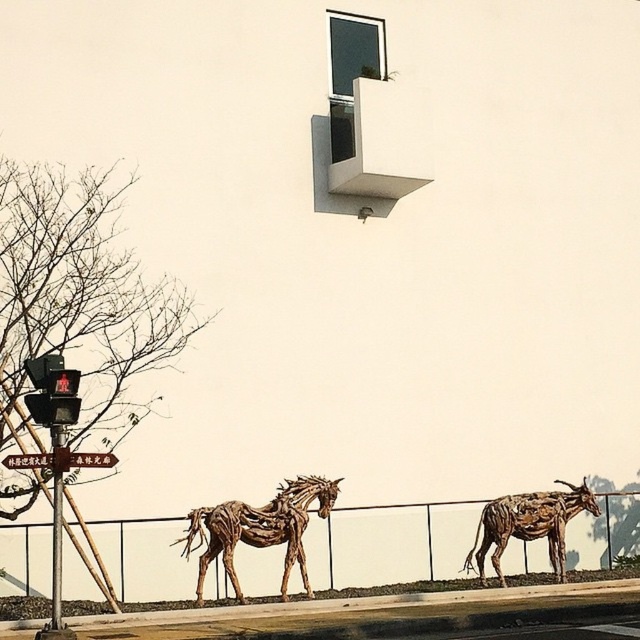
Does wooden sculpture of goat at lower right have a lesser height compared to metallic traffic light at left?

Incorrect, wooden sculpture of goat at lower right's height does not fall short of metallic traffic light at left's.

Which is in front, point (528, 525) or point (76, 403)?

Point (76, 403)

Who is more forward, (570, 483) or (54, 394)?

Point (54, 394) is more forward.

Identify the location of wooden sculpture of goat at lower right. The height and width of the screenshot is (640, 640). (529, 524).

Is wooden horse at center bigger than brushed metal sign at lower left?

Yes.

Which is below, wooden horse at center or brushed metal sign at lower left?

wooden horse at center is below.

Who is more distant from viewer, (236, 536) or (83, 458)?

The point (236, 536) is behind.

You are a GUI agent. You are given a task and a screenshot of the screen. Output one action in this format:
    pyautogui.click(x=<x>, y=<y>)
    Task: Click on the wooden horse at center
    
    Given the screenshot: What is the action you would take?
    pyautogui.click(x=259, y=529)

Does metallic traffic light at left have a smaller size compared to brushed metal sign at lower left?

No, metallic traffic light at left is not smaller than brushed metal sign at lower left.

Does point (52, 388) lie in front of point (22, 461)?

Yes, point (52, 388) is in front of point (22, 461).

Find the location of `metallic traffic light at left`. metallic traffic light at left is located at coordinates [x=52, y=390].